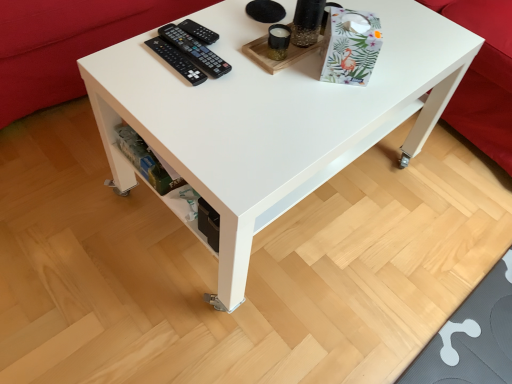
The height and width of the screenshot is (384, 512). What are the coordinates of `vacant space to the right of black plastic remote at upper center, positioned as the 1th control in top-to-bottom order` in the screenshot? It's located at (258, 45).